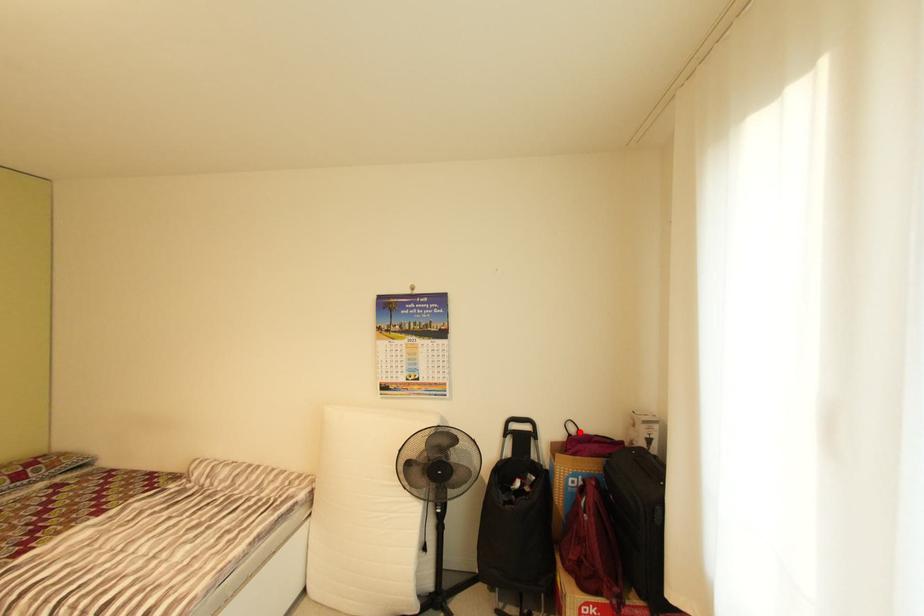
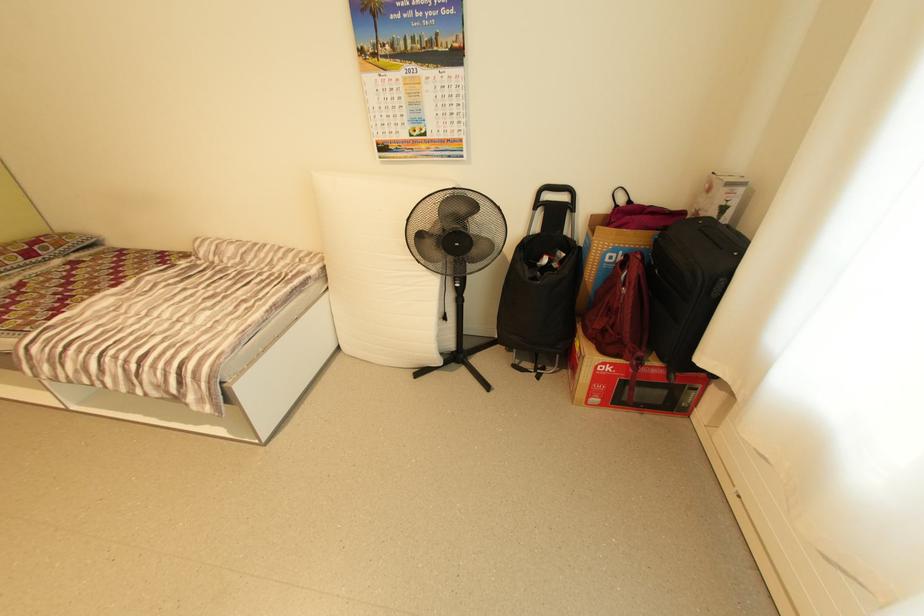
Question: I am providing you with two images of the same scene from different viewpoints. Given a red point in image1, look at the same physical point in image2. Is it:

Choices:
 (A) Closer to the viewpoint
 (B) Farther from the viewpoint

Answer: (A)